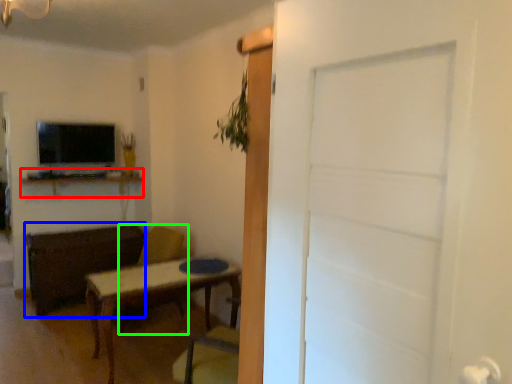
Question: Which object is the farthest from computer desk (highlighted by a red box)? Choose among these: brown (highlighted by a blue box) or swivel chair (highlighted by a green box).

Choices:
 (A) brown
 (B) swivel chair

Answer: (B)